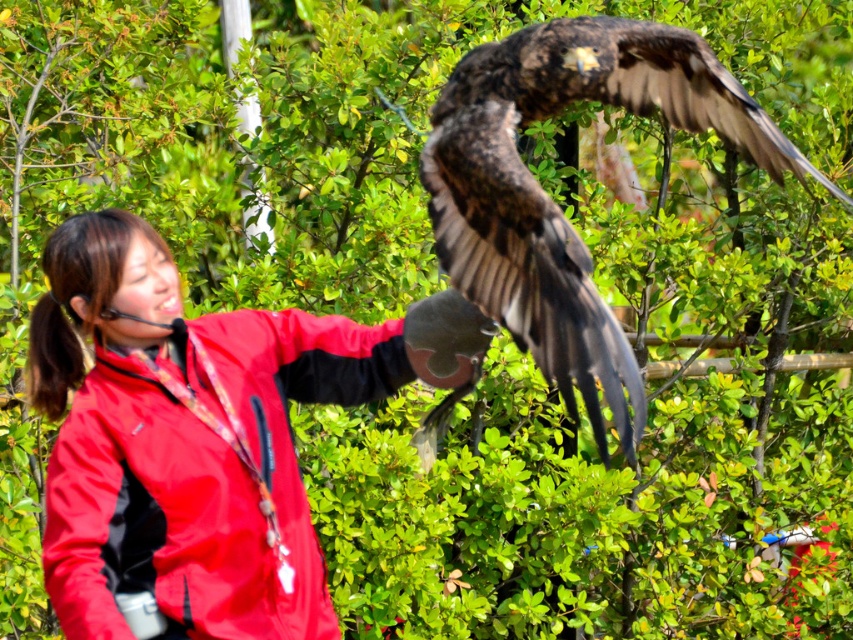
Is point (45, 310) more distant than point (715, 108)?

No, it is not.

Looking at this image, is matte red jacket at center above dark brown feathers at upper center?

Incorrect, matte red jacket at center is not positioned above dark brown feathers at upper center.

Which is in front, point (206, 448) or point (471, 131)?

Positioned in front is point (471, 131).

Find the location of a particular element. This screenshot has height=640, width=853. matte red jacket at center is located at coordinates (x=199, y=435).